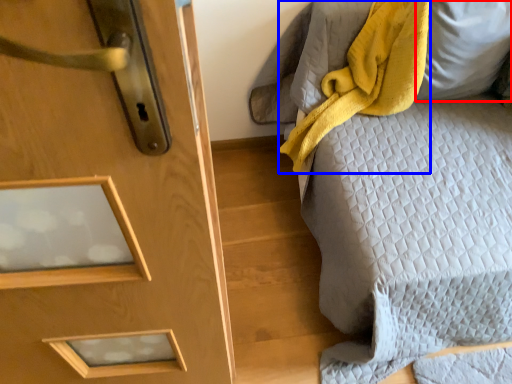
Question: Among these objects, which one is farthest to the camera, pillow (highlighted by a red box) or blanket (highlighted by a blue box)?

Choices:
 (A) pillow
 (B) blanket

Answer: (A)